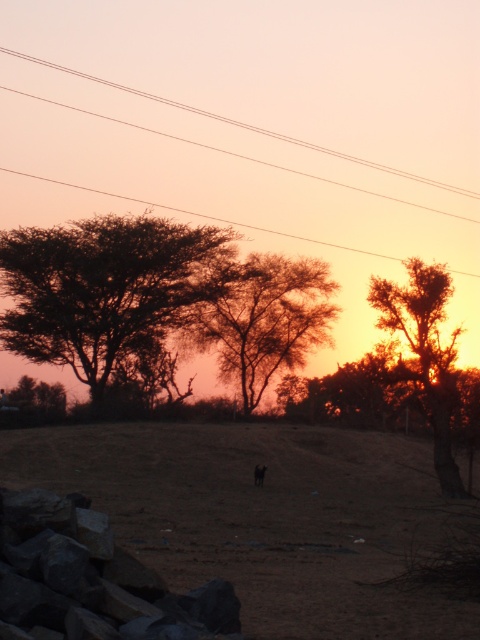
You are standing in the middle of the brown dirt field at center and looking towards the smooth wire power lines at upper center. Which object is closer to you?

The brown dirt field at center is closer to you than the smooth wire power lines at upper center.

You are standing in the middle of the field in the rural scene. You see two points marked in the image. Which point is closer to you, point [202,337] or point [259,474]?

Point [202,337] is closer to you because it is further to the viewer than point [259,474].

You are an artist trying to paint the scene. You want to ensure the brown dirt field at center and smooth wire power lines at upper center are proportionally accurate. Which object should you make wider in your painting?

The smooth wire power lines at upper center should be made wider in the painting since the brown dirt field at center is narrower than the smooth wire power lines at upper center according to the description.